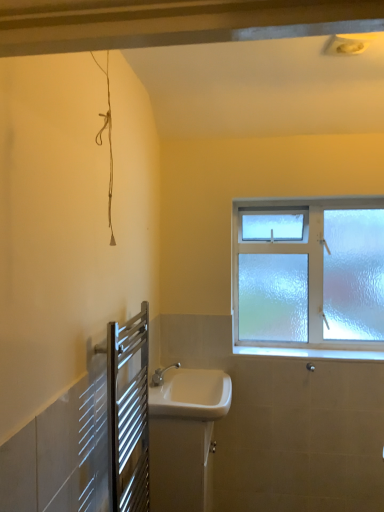
Describe the element at coordinates (184, 436) in the screenshot. Image resolution: width=384 pixels, height=512 pixels. I see `white glossy sink at lower center, the 2th sink viewed from the top` at that location.

This screenshot has height=512, width=384. I want to click on white glossy sink at lower center, the first sink ordered from the bottom, so click(x=184, y=436).

Describe the element at coordinates (191, 394) in the screenshot. I see `white ceramic sink at center, marked as the second sink in a bottom-to-top arrangement` at that location.

What do you see at coordinates (128, 414) in the screenshot?
I see `silver metallic towel rack at lower left` at bounding box center [128, 414].

The image size is (384, 512). I want to click on white glossy sink at lower center, the 2th sink viewed from the top, so coord(184,436).

Between white glossy sink at lower center, the 2th sink viewed from the top, and frosted glass window at upper right, which one appears on the left side from the viewer's perspective?

From the viewer's perspective, white glossy sink at lower center, the 2th sink viewed from the top, appears more on the left side.

Considering the relative sizes of white glossy sink at lower center, the first sink ordered from the bottom, and frosted glass window at upper right in the image provided, is white glossy sink at lower center, the first sink ordered from the bottom, smaller than frosted glass window at upper right?

Yes.

Which of these two, white glossy sink at lower center, the 2th sink viewed from the top, or frosted glass window at upper right, is wider?

white glossy sink at lower center, the 2th sink viewed from the top, is wider.

From the image's perspective, between white glossy sink at lower center, the 2th sink viewed from the top, and frosted glass window at upper right, which one is located above?

frosted glass window at upper right.

Is white glossy sink at lower center, the first sink ordered from the bottom, shorter than silver metallic towel rack at lower left?

Yes.

Which is more distant, (214,442) or (131,338)?

The point (214,442) is more distant.

From a real-world perspective, between white glossy sink at lower center, the first sink ordered from the bottom, and silver metallic towel rack at lower left, who is vertically higher?

In real-world perspective, silver metallic towel rack at lower left is above.

In the scene shown: Which object is closer to the camera taking this photo, white glossy sink at lower center, the first sink ordered from the bottom, or silver metallic towel rack at lower left?

silver metallic towel rack at lower left is in front.

Is silver metallic towel rack at lower left aimed at white glossy sink at lower center, the first sink ordered from the bottom?

No, silver metallic towel rack at lower left is not turned towards white glossy sink at lower center, the first sink ordered from the bottom.

Can we say silver metallic towel rack at lower left lies outside white glossy sink at lower center, the 2th sink viewed from the top?

Yes, silver metallic towel rack at lower left is not within white glossy sink at lower center, the 2th sink viewed from the top.

Which is in front, silver metallic towel rack at lower left or white glossy sink at lower center, the first sink ordered from the bottom?

silver metallic towel rack at lower left is more forward.

From a real-world perspective, is silver metallic towel rack at lower left on white glossy sink at lower center, the 2th sink viewed from the top?

Yes, from a real-world perspective, silver metallic towel rack at lower left is over white glossy sink at lower center, the 2th sink viewed from the top

From the image's perspective, which one is positioned higher, white ceramic sink at center, which is counted as the 1th sink, starting from the top, or white glossy sink at lower center, the first sink ordered from the bottom?

white ceramic sink at center, which is counted as the 1th sink, starting from the top, is shown above in the image.

Is point (184, 369) positioned before point (191, 409)?

No.

Is white ceramic sink at center, which is counted as the 1th sink, starting from the top, turned away from white glossy sink at lower center, the 2th sink viewed from the top?

No, white ceramic sink at center, which is counted as the 1th sink, starting from the top,'s orientation is not away from white glossy sink at lower center, the 2th sink viewed from the top.

Is white ceramic sink at center, which is counted as the 1th sink, starting from the top, bigger than white glossy sink at lower center, the first sink ordered from the bottom?

No.

In the image, is frosted glass window at upper right on the left side or the right side of white glossy sink at lower center, the first sink ordered from the bottom?

Clearly, frosted glass window at upper right is on the right of white glossy sink at lower center, the first sink ordered from the bottom, in the image.

Is frosted glass window at upper right positioned with its back to white glossy sink at lower center, the 2th sink viewed from the top?

No, frosted glass window at upper right is not facing away from white glossy sink at lower center, the 2th sink viewed from the top.

From the picture: Which of these two, frosted glass window at upper right or white glossy sink at lower center, the first sink ordered from the bottom, stands taller?

frosted glass window at upper right.

From a real-world perspective, is frosted glass window at upper right physically below white glossy sink at lower center, the first sink ordered from the bottom?

No, from a real-world perspective, frosted glass window at upper right is not below white glossy sink at lower center, the first sink ordered from the bottom.

Between frosted glass window at upper right and white ceramic sink at center, which is counted as the 1th sink, starting from the top, which one has smaller size?

white ceramic sink at center, which is counted as the 1th sink, starting from the top, is smaller.

Is frosted glass window at upper right not near white ceramic sink at center, marked as the second sink in a bottom-to-top arrangement?

No.

From the image's perspective, is frosted glass window at upper right beneath white ceramic sink at center, marked as the second sink in a bottom-to-top arrangement?

Actually, frosted glass window at upper right appears above white ceramic sink at center, marked as the second sink in a bottom-to-top arrangement, in the image.

Is white ceramic sink at center, marked as the second sink in a bottom-to-top arrangement, inside frosted glass window at upper right?

No, white ceramic sink at center, marked as the second sink in a bottom-to-top arrangement, is not inside frosted glass window at upper right.

Is white ceramic sink at center, marked as the second sink in a bottom-to-top arrangement, next to frosted glass window at upper right and touching it?

white ceramic sink at center, marked as the second sink in a bottom-to-top arrangement, and frosted glass window at upper right are clearly separated.

Which is correct: white ceramic sink at center, marked as the second sink in a bottom-to-top arrangement, is inside frosted glass window at upper right, or outside of it?

white ceramic sink at center, marked as the second sink in a bottom-to-top arrangement, is not enclosed by frosted glass window at upper right.

Which object is thinner, white ceramic sink at center, marked as the second sink in a bottom-to-top arrangement, or frosted glass window at upper right?

With smaller width is frosted glass window at upper right.

Based on the photo, is white ceramic sink at center, marked as the second sink in a bottom-to-top arrangement, to the left or to the right of frosted glass window at upper right in the image?

white ceramic sink at center, marked as the second sink in a bottom-to-top arrangement, is positioned on frosted glass window at upper right's left side.

At what (x,y) coordinates should I click in order to perform the action: click on sink that is the 2nd one when counting leftward from the frosted glass window at upper right. Please return your answer as a coordinate pair (x, y). The height and width of the screenshot is (512, 384). Looking at the image, I should click on pos(184,436).

From the image's perspective, which sink is the 2nd one below the silver metallic towel rack at lower left? Please provide its 2D coordinates.

[(184, 436)]

Based on their spatial positions, is white ceramic sink at center, which is counted as the 1th sink, starting from the top, or white glossy sink at lower center, the 2th sink viewed from the top, closer to frosted glass window at upper right?

white ceramic sink at center, which is counted as the 1th sink, starting from the top, lies closer to frosted glass window at upper right than the other object.

In the scene shown: Looking at the image, which one is located closer to white glossy sink at lower center, the first sink ordered from the bottom, silver metallic towel rack at lower left or white ceramic sink at center, marked as the second sink in a bottom-to-top arrangement?

white ceramic sink at center, marked as the second sink in a bottom-to-top arrangement, is closer to white glossy sink at lower center, the first sink ordered from the bottom.

From the picture: From the image, which object appears to be farther from frosted glass window at upper right, white ceramic sink at center, marked as the second sink in a bottom-to-top arrangement, or silver metallic towel rack at lower left?

silver metallic towel rack at lower left is positioned further to the anchor frosted glass window at upper right.

Based on their spatial positions, is silver metallic towel rack at lower left or frosted glass window at upper right closer to white glossy sink at lower center, the 2th sink viewed from the top?

The object closer to white glossy sink at lower center, the 2th sink viewed from the top, is silver metallic towel rack at lower left.

Looking at the image, which one is located closer to silver metallic towel rack at lower left, white ceramic sink at center, marked as the second sink in a bottom-to-top arrangement, or white glossy sink at lower center, the 2th sink viewed from the top?

white glossy sink at lower center, the 2th sink viewed from the top, is closer to silver metallic towel rack at lower left.

Which object lies further to the anchor point frosted glass window at upper right, white glossy sink at lower center, the first sink ordered from the bottom, or white ceramic sink at center, which is counted as the 1th sink, starting from the top?

Based on the image, white glossy sink at lower center, the first sink ordered from the bottom, appears to be further to frosted glass window at upper right.

Based on their spatial positions, is silver metallic towel rack at lower left or white ceramic sink at center, which is counted as the 1th sink, starting from the top, further from frosted glass window at upper right?

silver metallic towel rack at lower left lies further to frosted glass window at upper right than the other object.

Considering their positions, is white glossy sink at lower center, the first sink ordered from the bottom, positioned closer to silver metallic towel rack at lower left than frosted glass window at upper right?

Based on the image, white glossy sink at lower center, the first sink ordered from the bottom, appears to be nearer to silver metallic towel rack at lower left.

At what (x,y) coordinates should I click in order to perform the action: click on sink between silver metallic towel rack at lower left and white glossy sink at lower center, the 2th sink viewed from the top, along the z-axis. Please return your answer as a coordinate pair (x, y). The height and width of the screenshot is (512, 384). Looking at the image, I should click on (191, 394).

Locate an element on the screen. sink between frosted glass window at upper right and white glossy sink at lower center, the first sink ordered from the bottom, in the up-down direction is located at coordinates (191, 394).